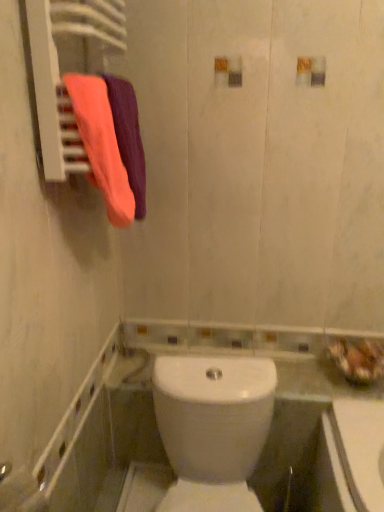
In order to face matte pink towel at left, the 1th bath towel in the front-to-back sequence, should I rotate leftwards or rightwards?

You should rotate left by 11.011 degrees.

Where is `white glossy toilet at center`? The height and width of the screenshot is (512, 384). white glossy toilet at center is located at coordinates (213, 428).

Can you confirm if orange cotton towel at upper left, the second bath towel positioned from the front, is thinner than matte pink towel at left, the 1th bath towel in the front-to-back sequence?

No.

From the image's perspective, is orange cotton towel at upper left, the second bath towel positioned from the front, located above or below matte pink towel at left, the 2th bath towel from the back?

orange cotton towel at upper left, the second bath towel positioned from the front, is situated higher than matte pink towel at left, the 2th bath towel from the back, in the image.

In the scene shown: Can you confirm if orange cotton towel at upper left, the second bath towel positioned from the front, is positioned to the left of matte pink towel at left, the 2th bath towel from the back?

Incorrect, orange cotton towel at upper left, the second bath towel positioned from the front, is not on the left side of matte pink towel at left, the 2th bath towel from the back.

In the image, is orange cotton towel at upper left, the second bath towel positioned from the front, positioned in front of or behind matte pink towel at left, the 2th bath towel from the back?

Clearly, orange cotton towel at upper left, the second bath towel positioned from the front, is behind matte pink towel at left, the 2th bath towel from the back.

Does orange cotton towel at upper left, which is counted as the 1th bath towel, starting from the back, touch white glossy toilet at center?

There is a gap between orange cotton towel at upper left, which is counted as the 1th bath towel, starting from the back, and white glossy toilet at center.

Between orange cotton towel at upper left, the second bath towel positioned from the front, and white glossy toilet at center, which one has smaller width?

With smaller width is orange cotton towel at upper left, the second bath towel positioned from the front.

How different are the orientations of orange cotton towel at upper left, which is counted as the 1th bath towel, starting from the back, and white glossy toilet at center in degrees?

75.1 degrees separate the facing orientations of orange cotton towel at upper left, which is counted as the 1th bath towel, starting from the back, and white glossy toilet at center.

From a real-world perspective, which object rests below the other?

white glossy toilet at center.

Does white glossy toilet at center appear on the right side of matte pink towel at left, the 1th bath towel in the front-to-back sequence?

Yes, white glossy toilet at center is to the right of matte pink towel at left, the 1th bath towel in the front-to-back sequence.

Would you say white glossy toilet at center is a long distance from matte pink towel at left, the 1th bath towel in the front-to-back sequence?

No, white glossy toilet at center is not far from matte pink towel at left, the 1th bath towel in the front-to-back sequence.

Which of these two, white glossy toilet at center or matte pink towel at left, the 1th bath towel in the front-to-back sequence, is thinner?

Thinner between the two is matte pink towel at left, the 1th bath towel in the front-to-back sequence.

Is matte pink towel at left, the 2th bath towel from the back, beside orange cotton towel at upper left, which is counted as the 1th bath towel, starting from the back?

Yes.

Where is `bath towel beneath the matte pink towel at left, the 1th bath towel in the front-to-back sequence (from a real-world perspective)`? Image resolution: width=384 pixels, height=512 pixels. bath towel beneath the matte pink towel at left, the 1th bath towel in the front-to-back sequence (from a real-world perspective) is located at coordinates (128, 137).

Which is closer, (108, 159) or (141, 211)?

The point (108, 159) is more forward.

Is white glossy toilet at center outside of orange cotton towel at upper left, the second bath towel positioned from the front?

Absolutely, white glossy toilet at center is external to orange cotton towel at upper left, the second bath towel positioned from the front.

Considering their positions, is white glossy toilet at center located in front of or behind orange cotton towel at upper left, the second bath towel positioned from the front?

Clearly, white glossy toilet at center is in front of orange cotton towel at upper left, the second bath towel positioned from the front.

Where is `toilet on the right of the orange cotton towel at upper left, which is counted as the 1th bath towel, starting from the back`? Image resolution: width=384 pixels, height=512 pixels. toilet on the right of the orange cotton towel at upper left, which is counted as the 1th bath towel, starting from the back is located at coordinates (213, 428).

Does white glossy toilet at center have a greater width compared to orange cotton towel at upper left, the second bath towel positioned from the front?

Indeed, white glossy toilet at center has a greater width compared to orange cotton towel at upper left, the second bath towel positioned from the front.

From a real-world perspective, is matte pink towel at left, the 2th bath towel from the back, above or below white glossy toilet at center?

In terms of real-world spatial position, matte pink towel at left, the 2th bath towel from the back, is above white glossy toilet at center.

Which is behind, point (107, 88) or point (260, 509)?

Positioned behind is point (260, 509).

Would you say matte pink towel at left, the 2th bath towel from the back, is inside or outside white glossy toilet at center?

matte pink towel at left, the 2th bath towel from the back, is outside white glossy toilet at center.

Who is taller, matte pink towel at left, the 1th bath towel in the front-to-back sequence, or white glossy toilet at center?

white glossy toilet at center is taller.

Where is `bath towel that appears below the orange cotton towel at upper left, which is counted as the 1th bath towel, starting from the back (from the image's perspective)`? The width and height of the screenshot is (384, 512). bath towel that appears below the orange cotton towel at upper left, which is counted as the 1th bath towel, starting from the back (from the image's perspective) is located at coordinates pos(111,142).

The width and height of the screenshot is (384, 512). Find the location of `toilet on the right of orange cotton towel at upper left, the second bath towel positioned from the front`. toilet on the right of orange cotton towel at upper left, the second bath towel positioned from the front is located at coordinates click(x=213, y=428).

When comparing their distances from orange cotton towel at upper left, the second bath towel positioned from the front, does white glossy toilet at center or matte pink towel at left, the 2th bath towel from the back, seem closer?

Among the two, matte pink towel at left, the 2th bath towel from the back, is located nearer to orange cotton towel at upper left, the second bath towel positioned from the front.

Considering their positions, is orange cotton towel at upper left, which is counted as the 1th bath towel, starting from the back, positioned closer to matte pink towel at left, the 1th bath towel in the front-to-back sequence, than white glossy toilet at center?

The object closer to matte pink towel at left, the 1th bath towel in the front-to-back sequence, is orange cotton towel at upper left, which is counted as the 1th bath towel, starting from the back.

Based on their spatial positions, is matte pink towel at left, the 1th bath towel in the front-to-back sequence, or orange cotton towel at upper left, the second bath towel positioned from the front, closer to white glossy toilet at center?

The object closer to white glossy toilet at center is matte pink towel at left, the 1th bath towel in the front-to-back sequence.

Estimate the real-world distances between objects in this image. Which object is further from orange cotton towel at upper left, which is counted as the 1th bath towel, starting from the back, matte pink towel at left, the 1th bath towel in the front-to-back sequence, or white glossy toilet at center?

The object further to orange cotton towel at upper left, which is counted as the 1th bath towel, starting from the back, is white glossy toilet at center.

Which object lies further to the anchor point white glossy toilet at center, orange cotton towel at upper left, the second bath towel positioned from the front, or matte pink towel at left, the 2th bath towel from the back?

Answer: orange cotton towel at upper left, the second bath towel positioned from the front, lies further to white glossy toilet at center than the other object.

When comparing their distances from matte pink towel at left, the 2th bath towel from the back, does white glossy toilet at center or orange cotton towel at upper left, the second bath towel positioned from the front, seem closer?

orange cotton towel at upper left, the second bath towel positioned from the front, lies closer to matte pink towel at left, the 2th bath towel from the back, than the other object.

Locate an element on the screen. bath towel between orange cotton towel at upper left, the second bath towel positioned from the front, and white glossy toilet at center in the up-down direction is located at coordinates (111, 142).